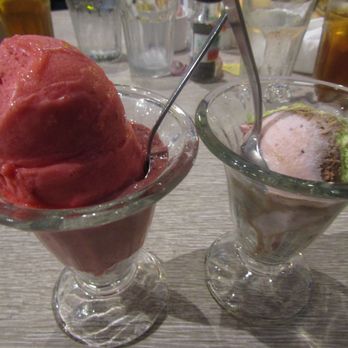
Where is `spoon`? Image resolution: width=348 pixels, height=348 pixels. spoon is located at coordinates (159, 122), (256, 90).